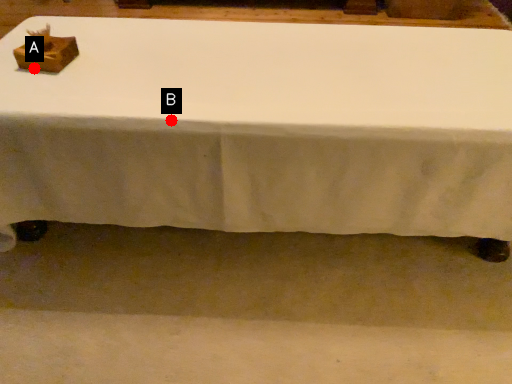
Question: Two points are circled on the image, labeled by A and B beside each circle. Which point is farther from the camera taking this photo?

Choices:
 (A) A is further
 (B) B is further

Answer: (A)